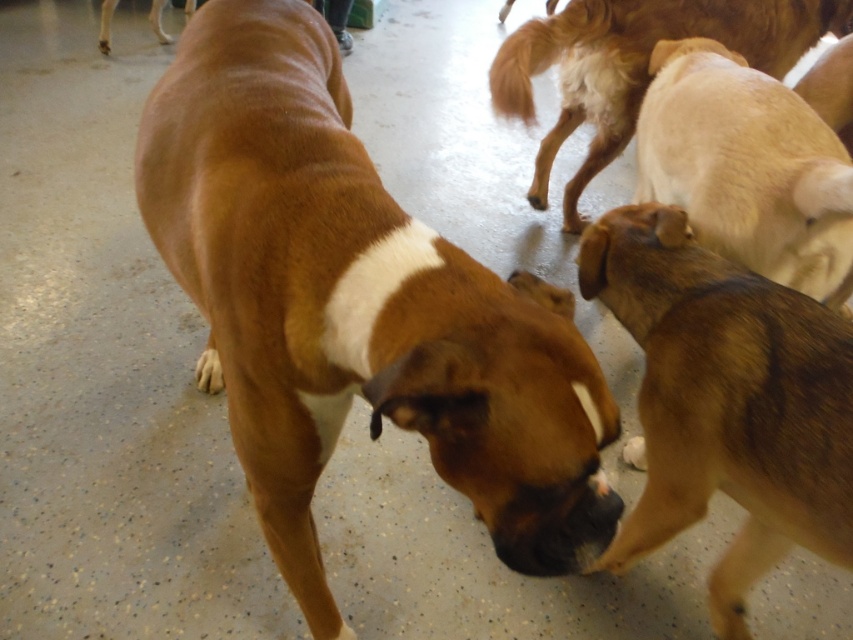
Is point (776, 400) farther from viewer compared to point (206, 362)?

No, it is not.

In order to click on brown furry dog at center in this screenshot , I will do `click(724, 401)`.

Which is above, brown furry dog at center or light brown fur at center?

Positioned higher is light brown fur at center.

Image resolution: width=853 pixels, height=640 pixels. What do you see at coordinates (724, 401) in the screenshot?
I see `brown furry dog at center` at bounding box center [724, 401].

Identify the location of brown furry dog at center. This screenshot has width=853, height=640. (724, 401).

Locate an element on the screen. The image size is (853, 640). brown furry dog at center is located at coordinates (724, 401).

Can you confirm if brown smooth dog at center is thinner than light brown fur paw at lower left?

No.

Is brown smooth dog at center smaller than light brown fur paw at lower left?

Actually, brown smooth dog at center might be larger than light brown fur paw at lower left.

Describe the element at coordinates (357, 307) in the screenshot. I see `brown smooth dog at center` at that location.

At what (x,y) coordinates should I click in order to perform the action: click on brown smooth dog at center. Please return your answer as a coordinate pair (x, y). The height and width of the screenshot is (640, 853). Looking at the image, I should click on (357, 307).